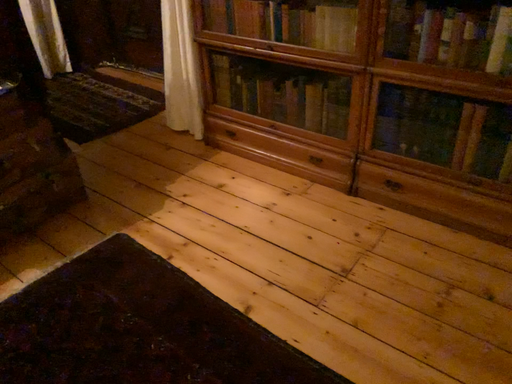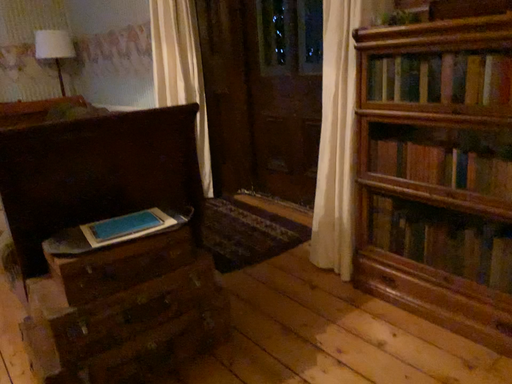
Question: How did the camera likely rotate when shooting the video?

Choices:
 (A) rotated downward
 (B) rotated upward

Answer: (B)